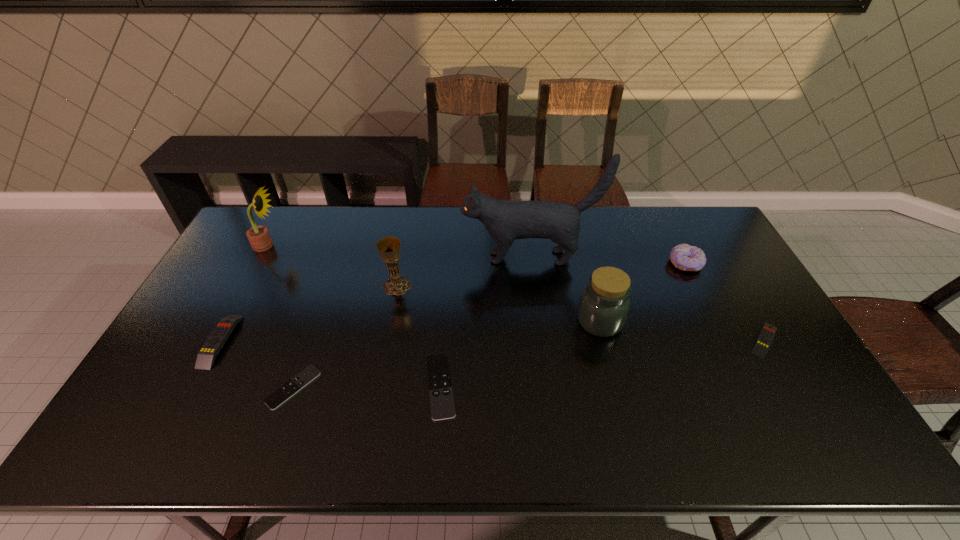
Image resolution: width=960 pixels, height=540 pixels. I want to click on sunflower present at the left edge, so click(x=258, y=236).

What are the coordinates of `remote control at the left edge` in the screenshot? It's located at (206, 356).

Where is `doughnut at the right edge`? doughnut at the right edge is located at coordinates (683, 256).

Locate an element on the screen. Image resolution: width=960 pixels, height=540 pixels. remote control that is at the right edge is located at coordinates (763, 342).

Where is `object that is positioned at the far left corner`? The width and height of the screenshot is (960, 540). object that is positioned at the far left corner is located at coordinates (258, 236).

Identify the location of free space at the far edge. The height and width of the screenshot is (540, 960). (303, 244).

Where is `free space at the near edge of the desktop`? free space at the near edge of the desktop is located at coordinates (670, 458).

Identify the location of vacant space at the left edge. (264, 255).

In the image, there is a desktop. Where is `vacant space at the right edge`? This screenshot has height=540, width=960. vacant space at the right edge is located at coordinates (707, 265).

Locate an element on the screen. The height and width of the screenshot is (540, 960). vacant space at the near left corner of the desktop is located at coordinates (162, 441).